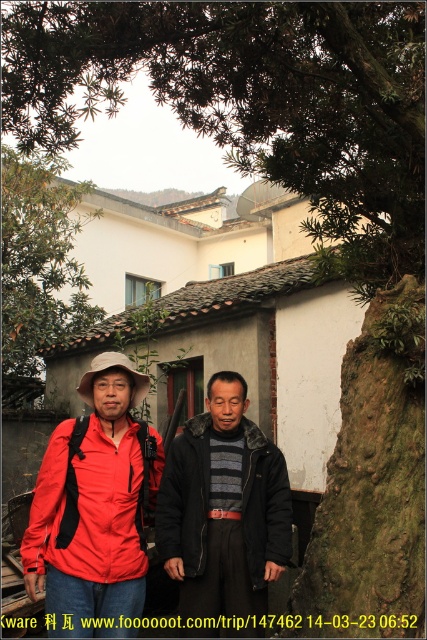
Question: Is matte red jacket at center smaller than matte red jacket at left?

Choices:
 (A) yes
 (B) no

Answer: (B)

Question: Can you confirm if matte red jacket at center is positioned to the right of dark gray woolen jacket at center?

Choices:
 (A) no
 (B) yes

Answer: (A)

Question: Which point is closer to the camera?

Choices:
 (A) (243, 540)
 (B) (117, 506)
 (C) (98, 419)

Answer: (B)

Question: Which of the following is the farthest from the observer?

Choices:
 (A) (251, 488)
 (B) (129, 465)

Answer: (A)

Question: Is matte red jacket at center behind dark gray woolen jacket at center?

Choices:
 (A) no
 (B) yes

Answer: (A)

Question: Which point appears farthest from the camera in this image?

Choices:
 (A) (113, 572)
 (B) (272, 464)
 (C) (152, 477)

Answer: (B)